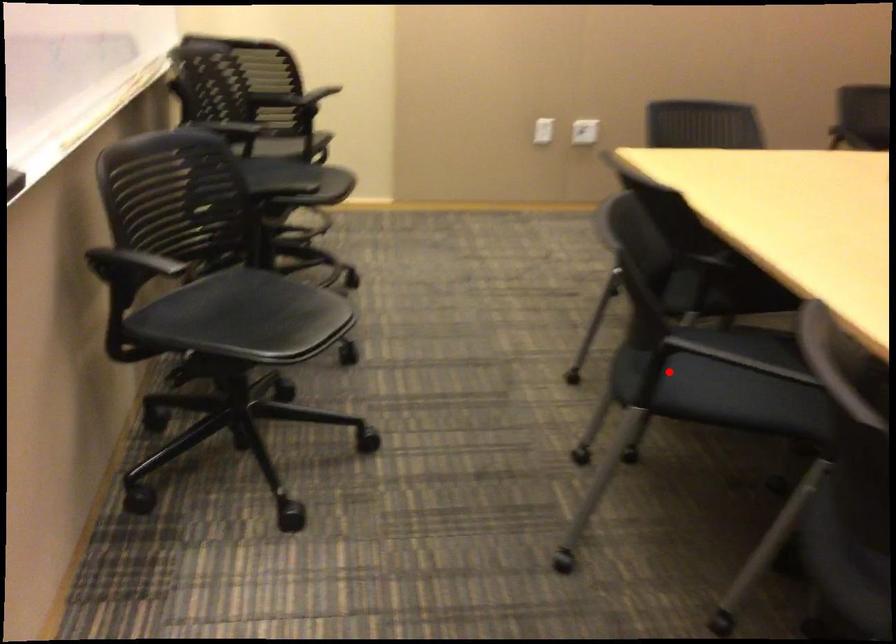
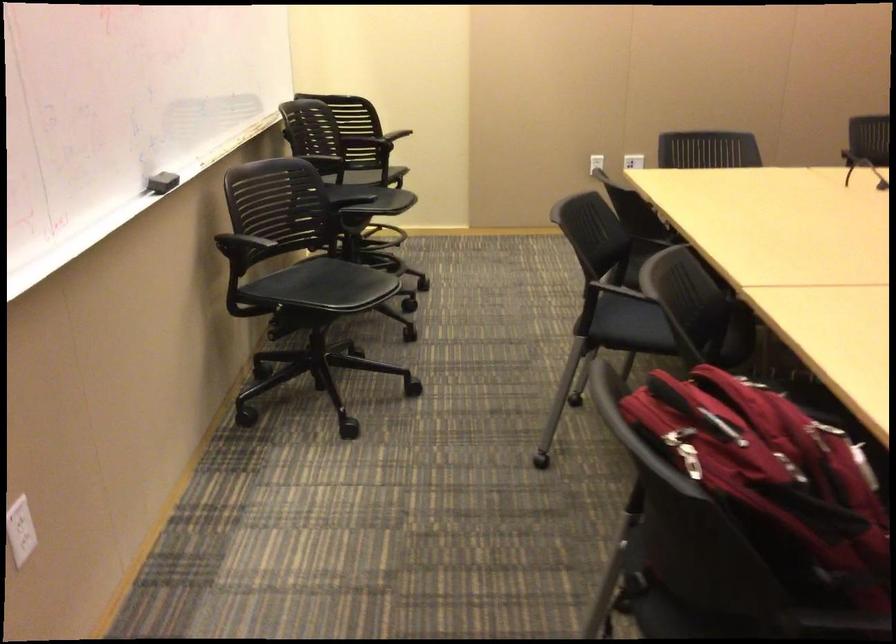
The point at the highlighted location is marked in the first image. Where is the corresponding point in the second image?

(629, 324)